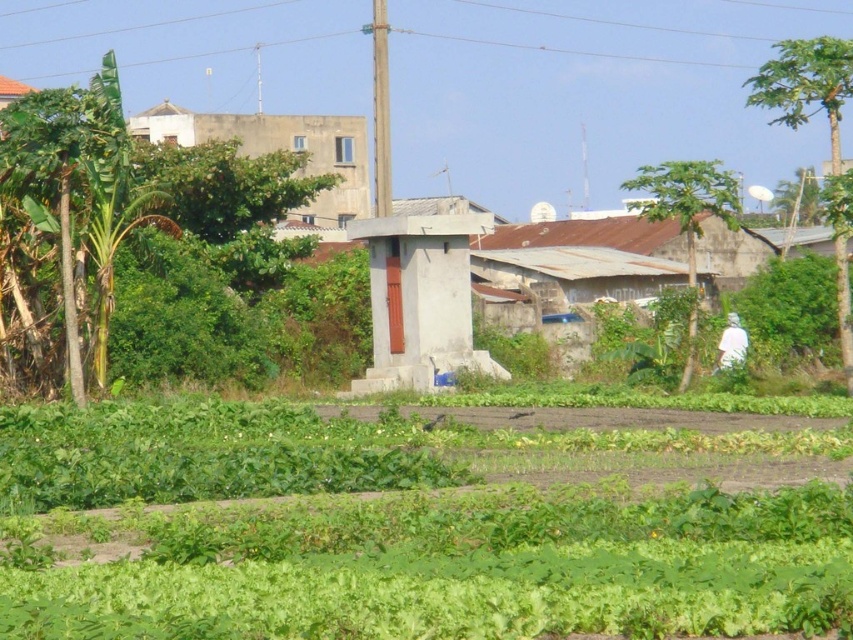
Question: Which of these objects is positioned farthest from the white matte shirt at right?

Choices:
 (A) green leafy at center
 (B) concrete building at upper center

Answer: (B)

Question: Which point is closer to the camera taking this photo?

Choices:
 (A) (730, 332)
 (B) (306, 460)
 (C) (299, 212)

Answer: (B)

Question: Is concrete building at upper center to the left of white matte shirt at right from the viewer's perspective?

Choices:
 (A) no
 (B) yes

Answer: (B)

Question: Can you confirm if green leafy at center is positioned below white matte shirt at right?

Choices:
 (A) yes
 (B) no

Answer: (A)

Question: Can you confirm if green leafy at center is positioned below white matte shirt at right?

Choices:
 (A) yes
 (B) no

Answer: (A)

Question: Which point appears farthest from the camera in this image?

Choices:
 (A) (231, 444)
 (B) (337, 166)

Answer: (B)